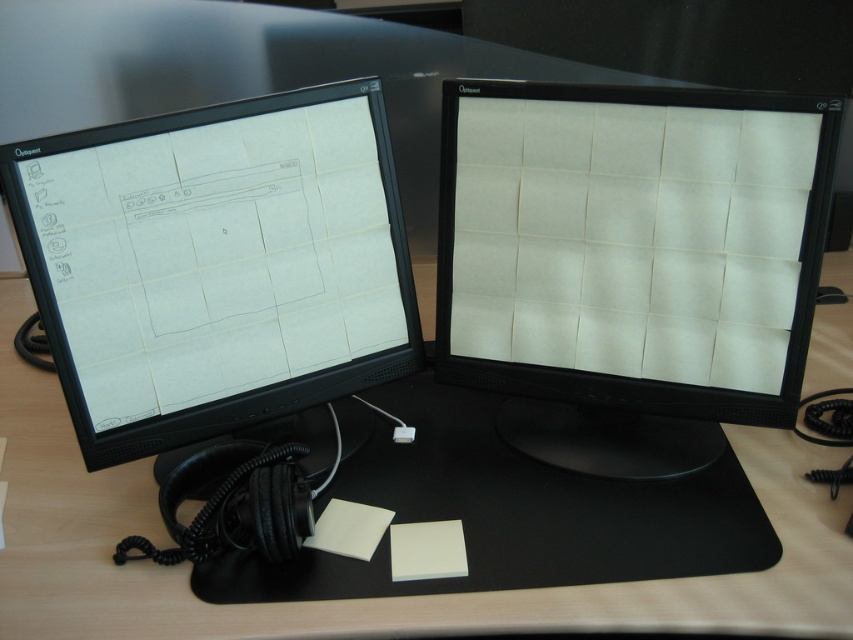
You are organizing your desk and want to place a new keyboard between the matte black monitor at left and the wooden table at center. Based on their positions, which object should the keyboard be closer to?

The matte black monitor at left is positioned on the left side of the wooden table at center, so the keyboard should be placed closer to the wooden table at center since it is to the right of the monitor.

You are setting up a new monitor stand and need to know the height difference between the matte black monitor at left and the wooden table at center. Which one is taller?

The matte black monitor at left is taller than the wooden table at center according to the description.

You are setting up a dual monitor system and want to place a new 27 inch monitor between the existing white matte computer monitor at center and the matte black monitor at left. Based on their sizes, will the new monitor fit in the space between them?

The white matte computer monitor at center is bigger than the matte black monitor at left. Since the new 27 inch monitor is larger than the smaller matte black monitor at left but smaller than the larger white matte computer monitor at center, it might not fit between them unless there is sufficient space. However, without specific measurements of the existing monitors and the available desk space, it is difficult to determine definitively.